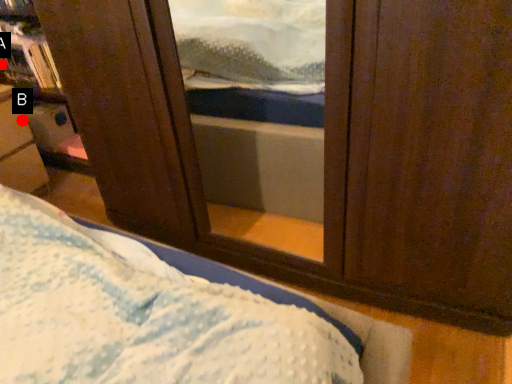
Question: Two points are circled on the image, labeled by A and B beside each circle. Which point appears closest to the camera in this image?

Choices:
 (A) A is closer
 (B) B is closer

Answer: (B)